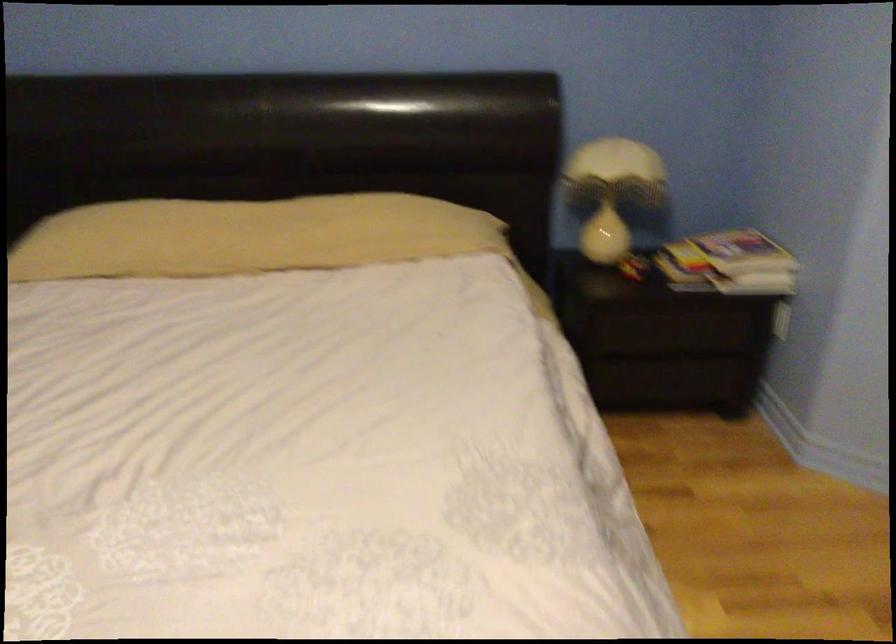
Find where to lift the white bedside lamp. Please return your answer as a coordinate pair (x, y).

(613, 191)